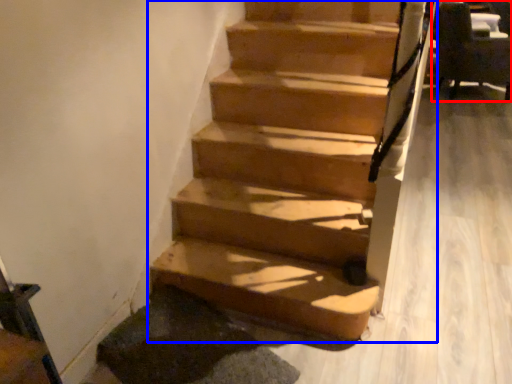
Question: Which of the following is the farthest to the observer, armchair (highlighted by a red box) or stairs (highlighted by a blue box)?

Choices:
 (A) armchair
 (B) stairs

Answer: (A)